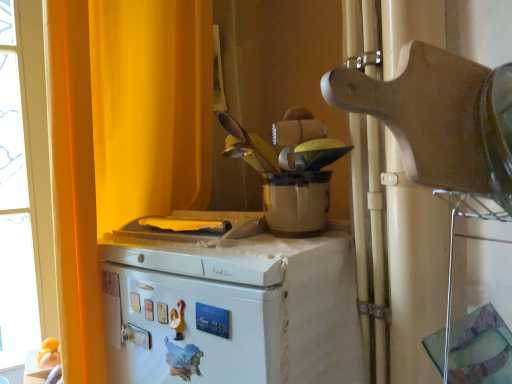
Question: From a real-world perspective, is matte white pot at center, marked as the 2th appliance in a front-to-back arrangement, on white matte refrigerator at center?

Choices:
 (A) no
 (B) yes

Answer: (B)

Question: Is the surface of matte white pot at center, marked as the 2th appliance in a front-to-back arrangement, in direct contact with white matte refrigerator at center?

Choices:
 (A) yes
 (B) no

Answer: (B)

Question: Is matte white pot at center, marked as the 2th appliance in a front-to-back arrangement, further to the viewer compared to white matte refrigerator at center?

Choices:
 (A) yes
 (B) no

Answer: (A)

Question: Is matte white pot at center, marked as the 2th appliance in a front-to-back arrangement, to the right of white matte refrigerator at center from the viewer's perspective?

Choices:
 (A) no
 (B) yes

Answer: (B)

Question: Is matte white pot at center, the first appliance positioned from the back, turned away from white matte refrigerator at center?

Choices:
 (A) yes
 (B) no

Answer: (B)

Question: Which is correct: yellow fabric curtain at upper left is inside wooden cutting board at upper right, arranged as the first appliance when viewed from the front, or outside of it?

Choices:
 (A) inside
 (B) outside

Answer: (B)

Question: From the image's perspective, relative to wooden cutting board at upper right, the second appliance from the back, is yellow fabric curtain at upper left above or below?

Choices:
 (A) below
 (B) above

Answer: (A)

Question: From a real-world perspective, is yellow fabric curtain at upper left above or below wooden cutting board at upper right, arranged as the first appliance when viewed from the front?

Choices:
 (A) below
 (B) above

Answer: (A)

Question: Looking at their shapes, would you say yellow fabric curtain at upper left is wider or thinner than wooden cutting board at upper right, the second appliance from the back?

Choices:
 (A) thin
 (B) wide

Answer: (A)

Question: Would you say wooden cutting board at upper right, arranged as the first appliance when viewed from the front, is inside or outside matte white pot at center, the first appliance positioned from the back?

Choices:
 (A) inside
 (B) outside

Answer: (B)

Question: Does point (498, 185) appear closer or farther from the camera than point (285, 185)?

Choices:
 (A) closer
 (B) farther

Answer: (A)

Question: From a real-world perspective, is wooden cutting board at upper right, the second appliance from the back, above or below matte white pot at center, the first appliance positioned from the back?

Choices:
 (A) below
 (B) above

Answer: (B)

Question: Considering the positions of wooden cutting board at upper right, arranged as the first appliance when viewed from the front, and matte white pot at center, the first appliance positioned from the back, in the image, is wooden cutting board at upper right, arranged as the first appliance when viewed from the front, bigger or smaller than matte white pot at center, the first appliance positioned from the back,?

Choices:
 (A) big
 (B) small

Answer: (B)

Question: From a real-world perspective, is white matte refrigerator at center physically located above or below matte white pot at center, marked as the 2th appliance in a front-to-back arrangement?

Choices:
 (A) above
 (B) below

Answer: (B)

Question: Is white matte refrigerator at center inside the boundaries of matte white pot at center, the first appliance positioned from the back, or outside?

Choices:
 (A) outside
 (B) inside

Answer: (A)